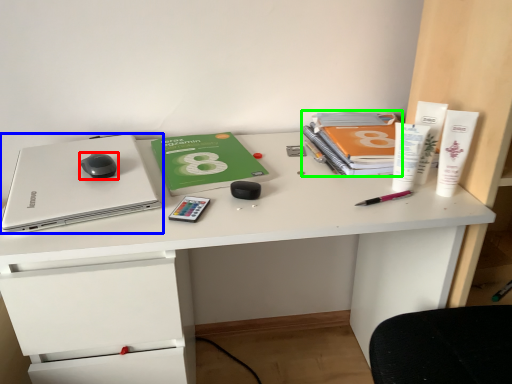
Question: Considering the real-world distances, which object is closest to mouse (highlighted by a red box)? laptop (highlighted by a blue box) or paperback book (highlighted by a green box).

Choices:
 (A) laptop
 (B) paperback book

Answer: (A)